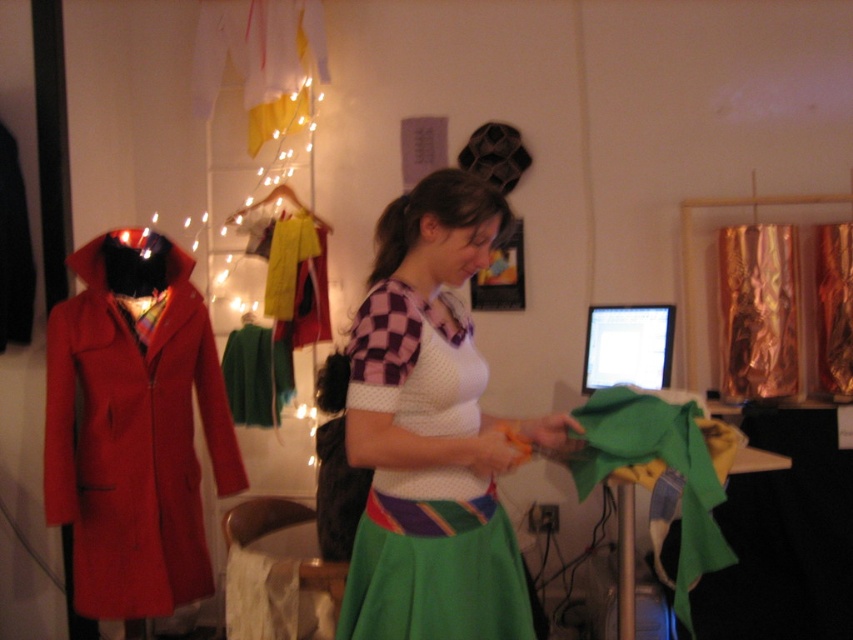
Who is taller, matte red coat at left or green felt at center?

matte red coat at left is taller.

Is matte red coat at left shorter than green felt at center?

In fact, matte red coat at left may be taller than green felt at center.

Does point (206, 307) lie behind point (699, 451)?

Yes, point (206, 307) is farther from viewer.

This screenshot has width=853, height=640. I want to click on matte red coat at left, so click(x=134, y=428).

Between point (392, 627) and point (688, 490), which one is positioned in front?

Point (392, 627) is more forward.

Who is higher up, white mesh top at center or green felt at center?

Positioned higher is white mesh top at center.

The height and width of the screenshot is (640, 853). Identify the location of white mesh top at center. (431, 433).

Is white mesh top at center shorter than matte red coat at left?

Yes, white mesh top at center is shorter than matte red coat at left.

From the picture: Can you confirm if white mesh top at center is bigger than matte red coat at left?

Indeed, white mesh top at center has a larger size compared to matte red coat at left.

Which is in front, point (500, 504) or point (183, 380)?

Point (500, 504)

Identify the location of white mesh top at center. This screenshot has width=853, height=640. (431, 433).